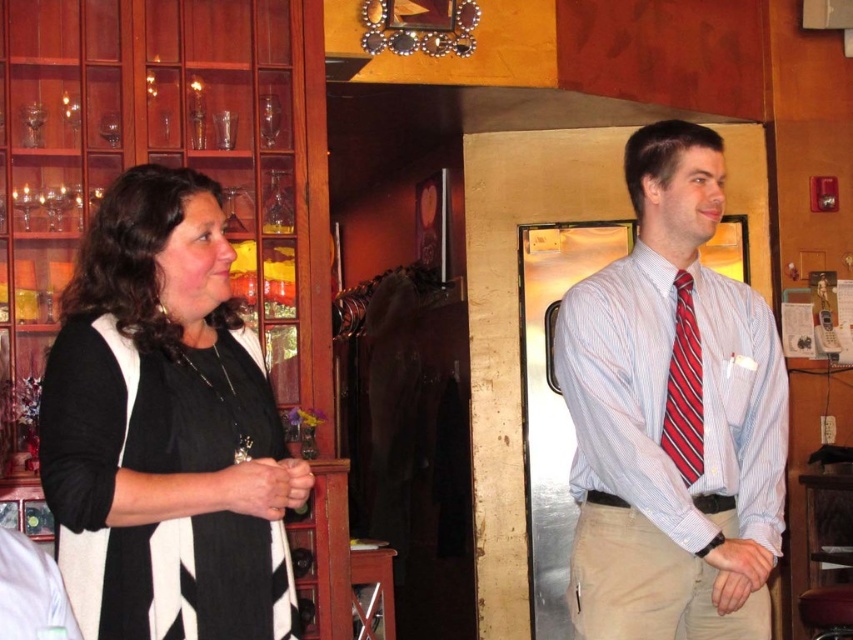
You are standing in the room and want to hand a document to the person wearing the striped cotton shirt at right. Based on their position in the image, which direction should you move to approach them?

The striped cotton shirt at right is located at point (x=672, y=417), so you should move towards the right side of the room to reach them.

You are a delivery person who needs to place a small package between the black matte sweater at left and the red striped tie at right. The package is 2 feet long. Is there enough space between them to fit the package?

The black matte sweater at left is 4.47 feet from the red striped tie at right. Since the package is only 2 feet long, there is sufficient space between them to place the package.

You are a tailor measuring a man for a new suit. You need to ensure the distance between the striped cotton shirt at right and the red striped tie at right is at least 7 inches to accommodate the new suit jacket. Based on the image, is the current distance sufficient?

The striped cotton shirt at right and red striped tie at right are 6.55 inches apart, which is less than the required 7 inches. Therefore, the current distance is insufficient for the new suit jacket.